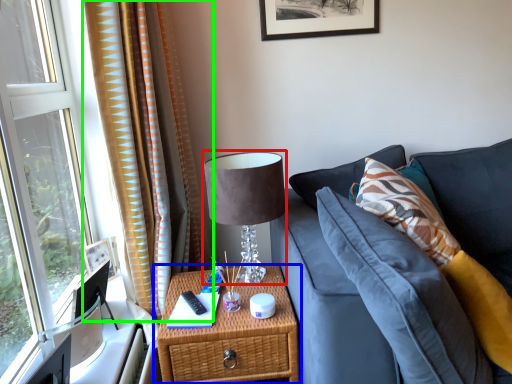
Question: Which object is the farthest from table lamp (highlighted by a red box)? Choose among these: nightstand (highlighted by a blue box) or curtain (highlighted by a green box).

Choices:
 (A) nightstand
 (B) curtain

Answer: (B)